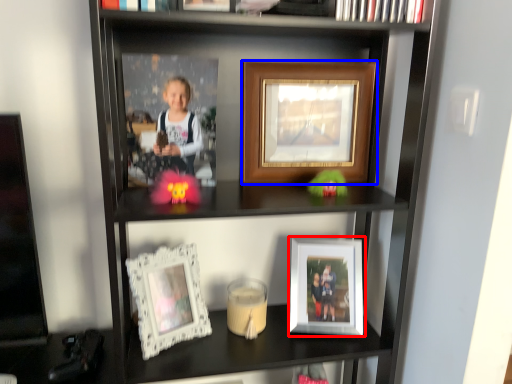
Question: Which object appears farthest to the camera in this image, picture frame (highlighted by a red box) or picture frame (highlighted by a blue box)?

Choices:
 (A) picture frame
 (B) picture frame

Answer: (A)